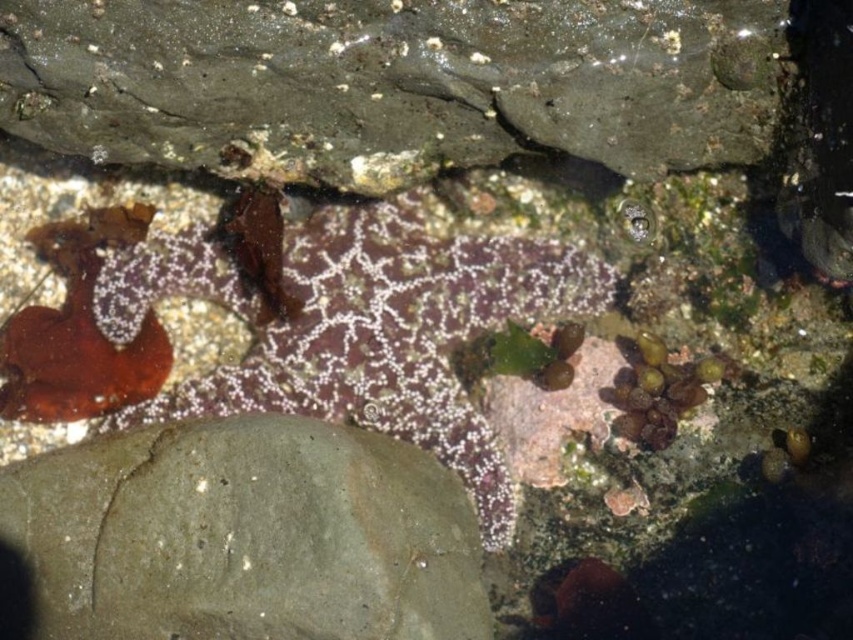
Question: Is smooth gray rock at upper center to the right of gray matte rock at center from the viewer's perspective?

Choices:
 (A) no
 (B) yes

Answer: (B)

Question: Which of the following is the closest to the observer?

Choices:
 (A) [473, 627]
 (B) [694, 97]

Answer: (B)

Question: Which point appears farthest from the camera in this image?

Choices:
 (A) (189, 442)
 (B) (276, 10)

Answer: (A)

Question: Can you confirm if smooth gray rock at upper center is positioned above gray matte rock at center?

Choices:
 (A) no
 (B) yes

Answer: (B)

Question: Does smooth gray rock at upper center have a smaller size compared to gray matte rock at center?

Choices:
 (A) no
 (B) yes

Answer: (B)